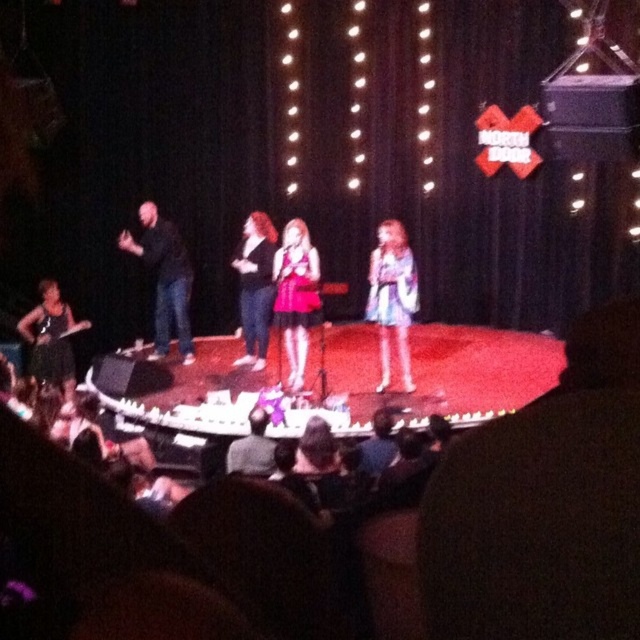
Is matte black dress at center below dark gray fabric hat at lower center?

No, matte black dress at center is not below dark gray fabric hat at lower center.

Does point (253, 316) come in front of point (272, 464)?

No, it is not.

The width and height of the screenshot is (640, 640). In order to click on matte black dress at center in this screenshot , I will do `click(256, 285)`.

Consider the image. Can you confirm if matte pink dress at center is wider than matte black dress at center?

In fact, matte pink dress at center might be narrower than matte black dress at center.

The image size is (640, 640). In order to click on matte pink dress at center in this screenshot , I will do `click(296, 296)`.

Image resolution: width=640 pixels, height=640 pixels. What do you see at coordinates (164, 278) in the screenshot?
I see `black matte shirt at left` at bounding box center [164, 278].

Is black matte shirt at left thinner than dark gray fabric hat at lower center?

In fact, black matte shirt at left might be wider than dark gray fabric hat at lower center.

Is point (168, 337) positioned behind point (234, 454)?

That is True.

Identify the location of black matte shirt at left. (164, 278).